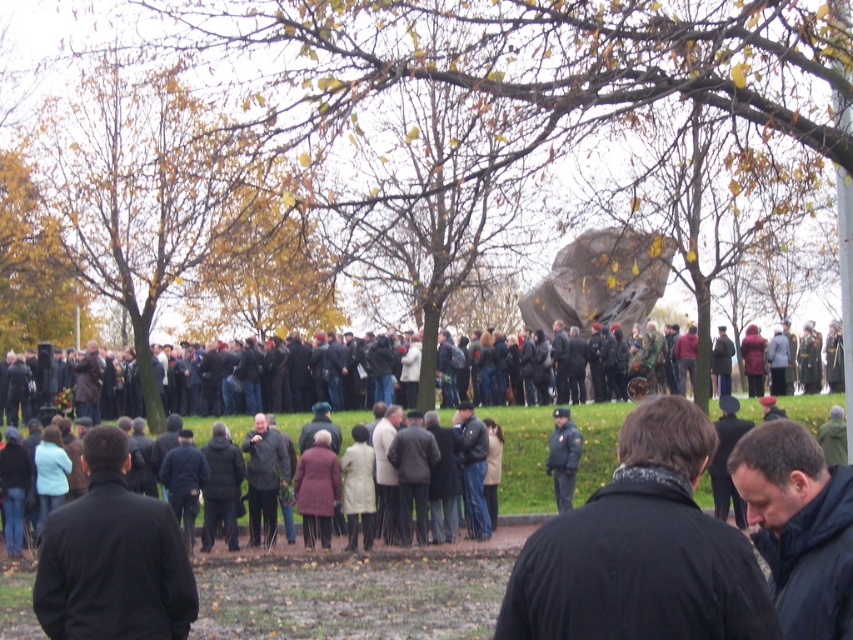
From the picture: You are standing at the edge of the paved area in the park. You see the rustic stone monument at center. If you want to go to the monument, which direction should you walk relative to the paved area?

The rustic stone monument at center is located at coordinates (601, 280), so you should walk forward from the paved area towards the center of the image to reach it.

You are organizing a photo shoot in the park and need to place two identical mannequins wearing black matte jackets. The first mannequin will be placed where the black matte jacket at center is, and the second where the black matte jacket at lower left is. Since the jackets are identical, why would the one at center appear wider than the one at lower left?

The black matte jacket at center appears wider than the black matte jacket at lower left because the object at center has a greater width than the one at lower left, even though they are the same jacket. This could be due to perspective or camera angle, making the central jacket look wider despite being the same size.

You are standing at the center of the paved area and want to see which person in the black matte jackets is taller. Since both jackets are black and matte, how can you determine which one is taller between the black matte jacket at lower left and the black matte jacket at lower right?

The black matte jacket at lower left is shorter than the black matte jacket at lower right, so the one at the lower right is taller.